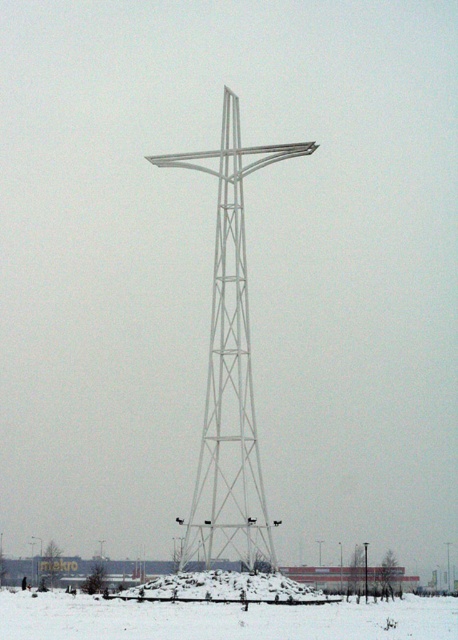
You are an engineer assessing the structural integrity of the white metallic cross at center and the white metallic pole at center. Based on their heights, which one might require additional support to prevent toppling?

The white metallic cross at center is much taller than the white metallic pole at center, so it might require additional support to prevent toppling due to its greater height increasing the risk of instability.

You are a delivery drone with a maximum flight range of 20 meters. You need to deliver a package from the white metallic cross at center to the white powdery snow at center. Can you complete the delivery without needing to recharge?

The distance between the white metallic cross at center and the white powdery snow at center is 17.30 meters, which is within your 20 meter range. Yes, you can complete the delivery without needing to recharge.

Looking at this image, what are the coordinates of the white metallic cross at center in the image?

The white metallic cross at center is located at coordinates point [229,368].